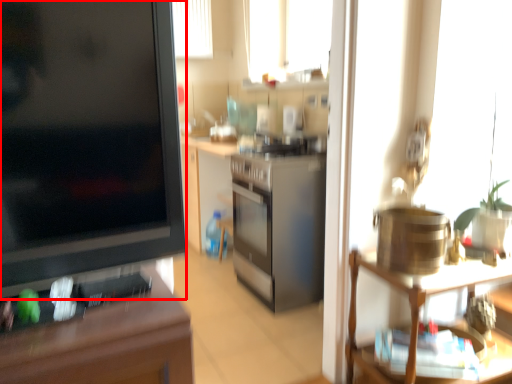
Question: In this image, where is desk (annotated by the red box) located relative to shelf?

Choices:
 (A) left
 (B) right

Answer: (A)